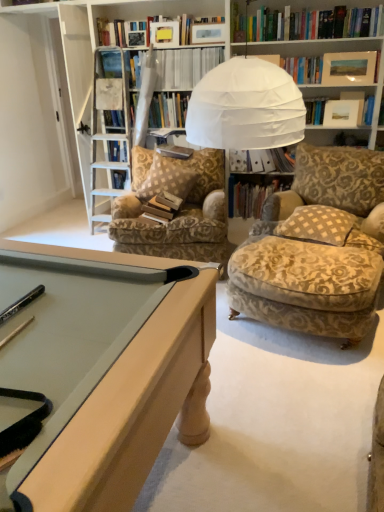
Question: Is brown checkered pillow at center, the second pillow positioned from the right, at the back of white paper file at center, arranged as the third book when ordered from the bottom?

Choices:
 (A) yes
 (B) no

Answer: (B)

Question: Is white paper file at center, arranged as the third book when ordered from the bottom, bigger than brown checkered pillow at center, the second pillow positioned from the right?

Choices:
 (A) yes
 (B) no

Answer: (B)

Question: From the image's perspective, does white paper file at center, arranged as the third book when ordered from the bottom, appear higher than brown checkered pillow at center, the first pillow in the back-to-front sequence?

Choices:
 (A) yes
 (B) no

Answer: (A)

Question: Is white paper file at center, arranged as the third book when ordered from the bottom, smaller than brown checkered pillow at center, which is the second pillow in front-to-back order?

Choices:
 (A) no
 (B) yes

Answer: (B)

Question: From a real-world perspective, is white paper file at center, arranged as the third book when ordered from the bottom, under brown checkered pillow at center, which is the second pillow in front-to-back order?

Choices:
 (A) no
 (B) yes

Answer: (A)

Question: Looking at the image, does patterned fabric chair at center, which is counted as the second chair, starting from the front, seem bigger or smaller compared to velvet beige ottoman at lower right, which is counted as the first chair, starting from the right?

Choices:
 (A) small
 (B) big

Answer: (B)

Question: In terms of height, does patterned fabric chair at center, which appears as the first chair when viewed from the back, look taller or shorter compared to velvet beige ottoman at lower right, which is the first chair in front-to-back order?

Choices:
 (A) short
 (B) tall

Answer: (B)

Question: In the image, is patterned fabric chair at center, which appears as the first chair when viewed from the back, positioned in front of or behind velvet beige ottoman at lower right, which is the first chair in front-to-back order?

Choices:
 (A) front
 (B) behind

Answer: (B)

Question: Is point (223, 202) positioned closer to the camera than point (251, 292)?

Choices:
 (A) closer
 (B) farther

Answer: (B)

Question: Is hardcover book at center, placed as the second book when sorted from bottom to top, wider or thinner than brown checkered pillow at center, the first pillow in the back-to-front sequence?

Choices:
 (A) thin
 (B) wide

Answer: (A)

Question: Considering the positions of hardcover book at center, placed as the second book when sorted from bottom to top, and brown checkered pillow at center, the second pillow positioned from the right, in the image, is hardcover book at center, placed as the second book when sorted from bottom to top, taller or shorter than brown checkered pillow at center, the second pillow positioned from the right,?

Choices:
 (A) tall
 (B) short

Answer: (B)

Question: Is point (266, 179) positioned closer to the camera than point (185, 183)?

Choices:
 (A) farther
 (B) closer

Answer: (A)

Question: From a real-world perspective, is hardcover book at center, placed as the second book when sorted from bottom to top, physically located above or below brown checkered pillow at center, the first pillow in the back-to-front sequence?

Choices:
 (A) below
 (B) above

Answer: (A)

Question: Considering the positions of velvet beige ottoman at lower right, the 2th chair from the left, and white paper file at center, arranged as the third book when ordered from the bottom, in the image, is velvet beige ottoman at lower right, the 2th chair from the left, taller or shorter than white paper file at center, arranged as the third book when ordered from the bottom,?

Choices:
 (A) tall
 (B) short

Answer: (A)

Question: Based on their positions, is velvet beige ottoman at lower right, which is counted as the first chair, starting from the right, located to the left or right of white paper file at center, the second book viewed from the top?

Choices:
 (A) right
 (B) left

Answer: (B)